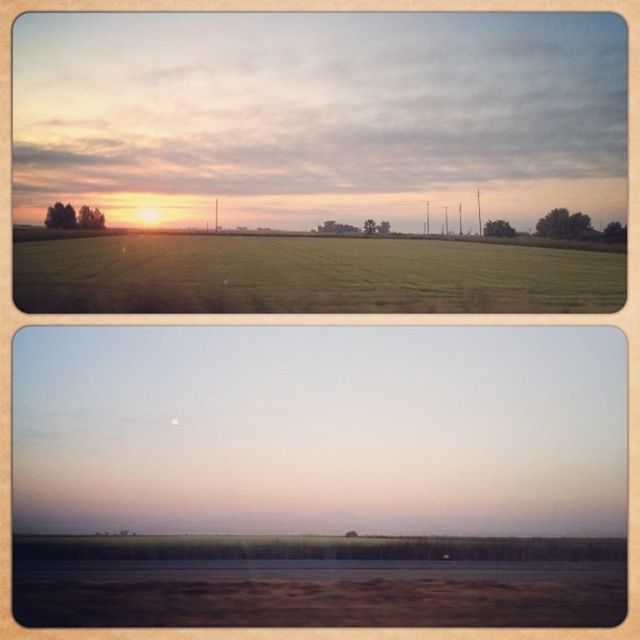
Question: Estimate the real-world distances between objects in this image. Which object is farther from the green matte trees at left?

Choices:
 (A) green leafy tree at center
 (B) green matte tree at center

Answer: (A)

Question: Which of the following is the farthest from the observer?

Choices:
 (A) (586, 480)
 (B) (58, 204)
 (C) (202, 296)
 (D) (90, 225)

Answer: (B)

Question: Can you confirm if green leafy tree at upper right is positioned to the left of green leafy tree at center?

Choices:
 (A) no
 (B) yes

Answer: (A)

Question: Can you confirm if green grassy field at center is positioned above green matte trees at left?

Choices:
 (A) no
 (B) yes

Answer: (A)

Question: Does green grassy field at center have a lesser width compared to green leafy tree at right?

Choices:
 (A) no
 (B) yes

Answer: (A)

Question: Among these objects, which one is farthest from the camera?

Choices:
 (A) green matte trees at left
 (B) green leafy tree at center

Answer: (B)